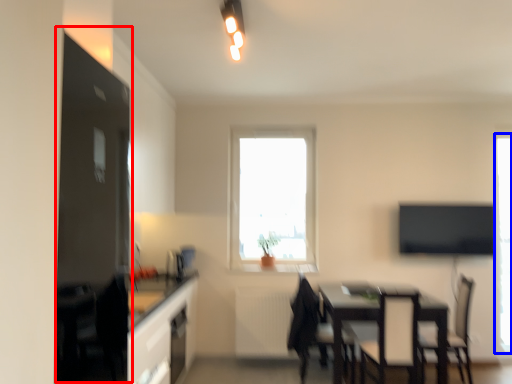
Question: Which point is further to the camera, fridge (highlighted by a red box) or window (highlighted by a blue box)?

Choices:
 (A) fridge
 (B) window

Answer: (B)